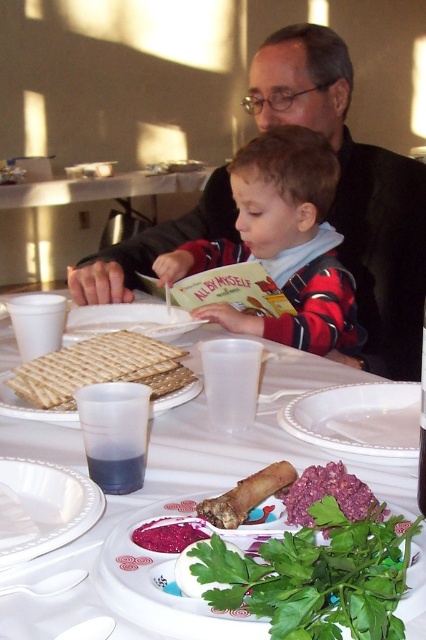
You are a guest at a Passover Seder and need to place your napkin on the table. The host mentioned that items should be placed at least 12 inches apart for proper spacing. Can you place your napkin near the white porcelain plate at center without violating the spacing rule with the matte brown matzah at center?

The distance between the white porcelain plate at center and the matte brown matzah at center is 15.08 inches. Since 15.08 inches is greater than the required 12 inches, placing your napkin near the white porcelain plate at center would comply with the host

You are a guest at the Passover Seder table. You need to place a small salt shaker between the green leafy parsley at lower center and the matte brown matzah at center. Can the salt shaker fit between them without overlapping either item?

The green leafy parsley at lower center is narrower than the matte brown matzah at center. Since the parsley is smaller in width, there should be enough space between them to place the salt shaker without overlapping either item.